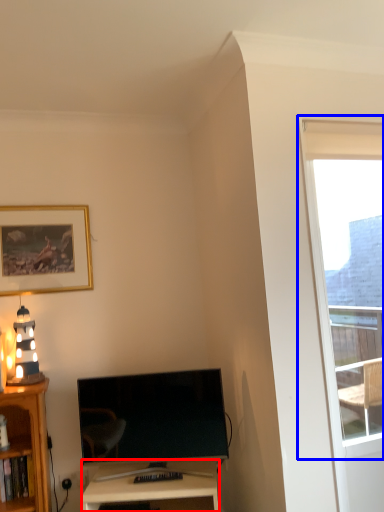
Question: Which of the following is the closest to the observer, desk (highlighted by a red box) or window (highlighted by a blue box)?

Choices:
 (A) desk
 (B) window

Answer: (B)